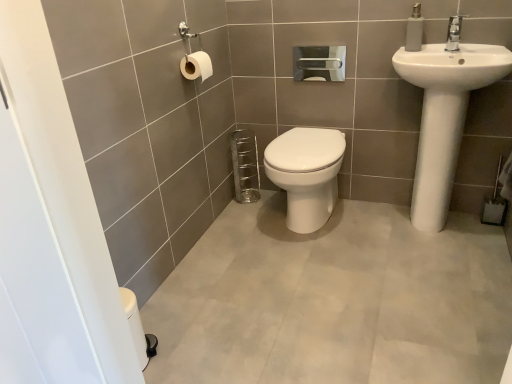
Question: Based on their sizes in the image, would you say white glossy toilet at center is bigger or smaller than white glossy toilet paper at upper center, the second toilet paper from the left?

Choices:
 (A) small
 (B) big

Answer: (B)

Question: Is point (387, 279) closer or farther from the camera than point (330, 77)?

Choices:
 (A) farther
 (B) closer

Answer: (B)

Question: Which of these objects is positioned farthest from the white matte soap dispenser at upper right?

Choices:
 (A) white glossy sink at upper right
 (B) white ceramic faucet at upper right
 (C) white glossy toilet paper at upper center, the second toilet paper from the left
 (D) white matte toilet paper at upper left, the 2th toilet paper in the right-to-left sequence
 (E) white glossy toilet at center

Answer: (D)

Question: Which object is the closest to the white glossy toilet at center?

Choices:
 (A) white glossy sink at upper right
 (B) white glossy toilet at center
 (C) white matte toilet paper at upper left, acting as the first toilet paper starting from the front
 (D) white matte soap dispenser at upper right
 (E) white ceramic faucet at upper right

Answer: (B)